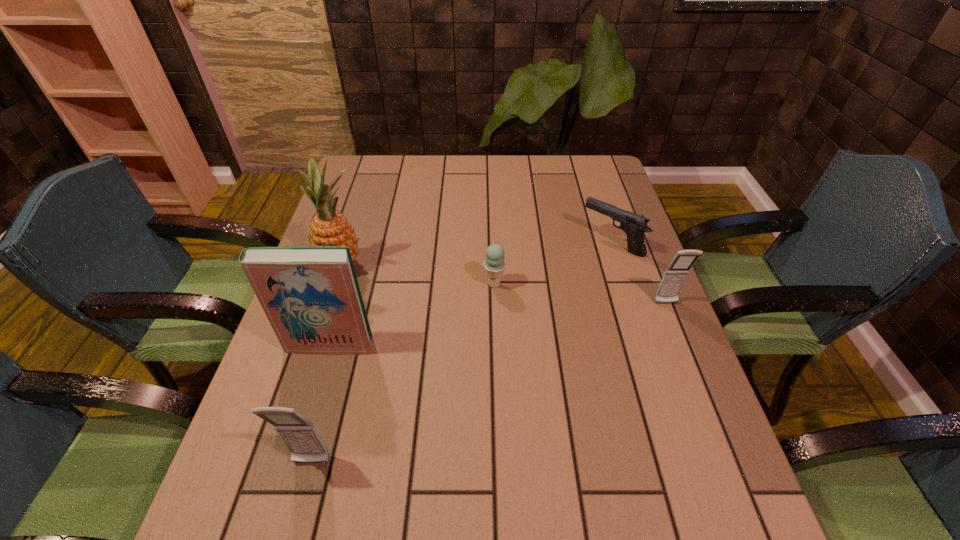
What are the coordinates of `vacant area that lies between the fourth object from left to right and the third nearest object` in the screenshot? It's located at (580, 294).

The height and width of the screenshot is (540, 960). I want to click on empty space between the shorter cellular telephone and the pineapple, so click(504, 285).

At what (x,y) coordinates should I click in order to perform the action: click on vacant area between the nearest object and the gun. Please return your answer as a coordinate pair (x, y). The image size is (960, 540). Looking at the image, I should click on coord(462,353).

The height and width of the screenshot is (540, 960). Find the location of `vacant point located between the pineapple and the ice cream`. vacant point located between the pineapple and the ice cream is located at coordinates (419, 275).

The width and height of the screenshot is (960, 540). I want to click on free spot between the left cellular telephone and the pineapple, so click(x=327, y=365).

This screenshot has height=540, width=960. Find the location of `blank region between the nearer cellular telephone and the fourth farthest object`. blank region between the nearer cellular telephone and the fourth farthest object is located at coordinates (489, 383).

What are the coordinates of `vacant space that's between the fourth farthest object and the gun` in the screenshot? It's located at (638, 273).

Choose which object is the third nearest neighbor to the ice cream. Please provide its 2D coordinates. Your answer should be formatted as a tuple, i.e. [(x, y)], where the tuple contains the x and y coordinates of a point satisfying the conditions above.

[(328, 227)]

What are the coordinates of `object that is the third closest one to the third object from right to left` in the screenshot? It's located at (328, 227).